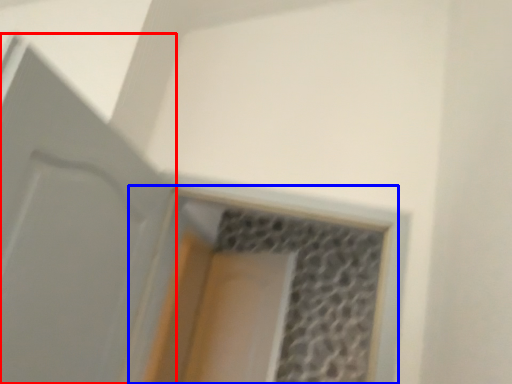
Question: Among these objects, which one is nearest to the camera, door (highlighted by a red box) or window (highlighted by a blue box)?

Choices:
 (A) door
 (B) window

Answer: (A)